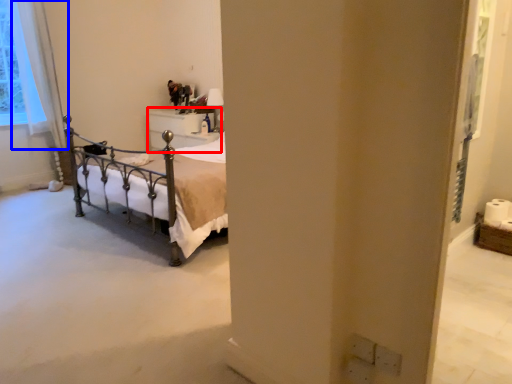
Question: Which point is further to the camera, furniture (highlighted by a red box) or curtain (highlighted by a blue box)?

Choices:
 (A) furniture
 (B) curtain

Answer: (A)